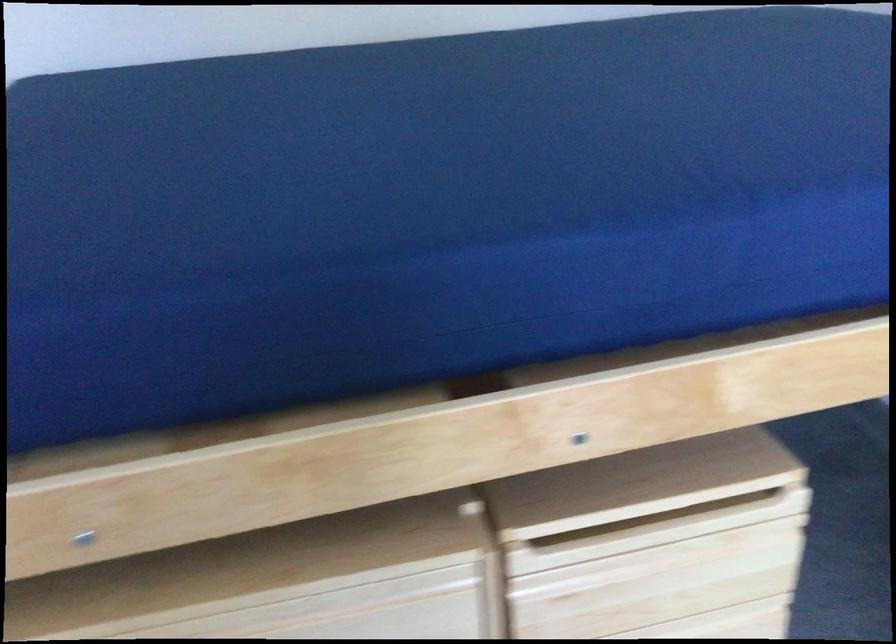
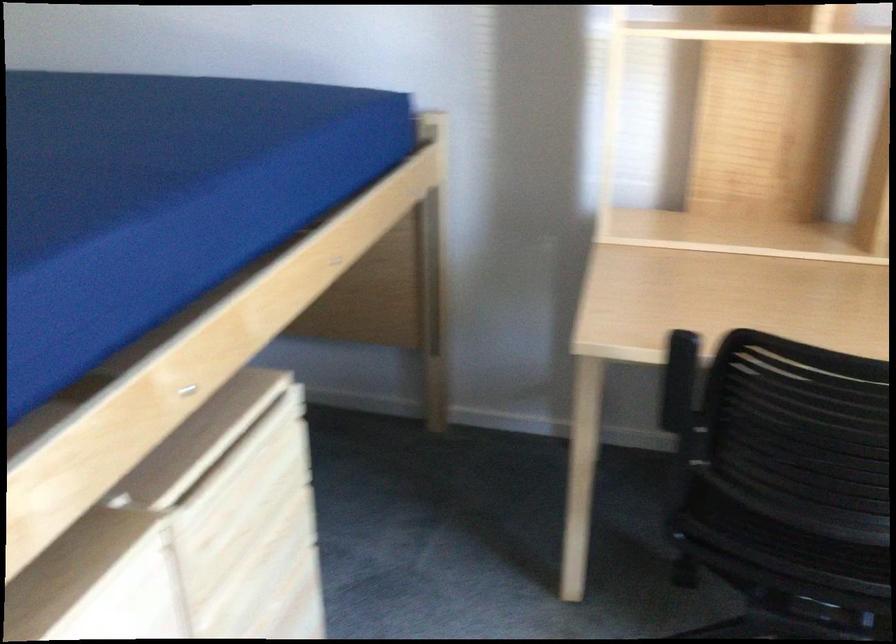
In the second image, find the point that corresponds to (x=636, y=482) in the first image.

(202, 439)